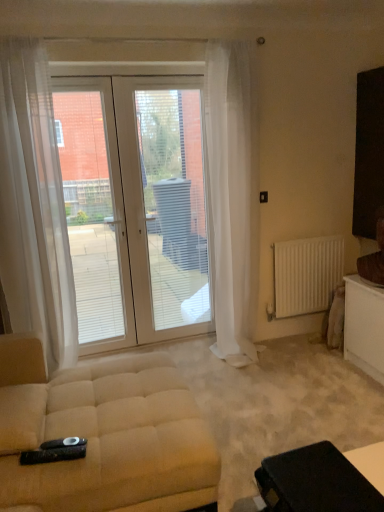
Question: Is white glass door at center to the left of white matte radiator at right from the viewer's perspective?

Choices:
 (A) yes
 (B) no

Answer: (A)

Question: Does white glass door at center have a smaller size compared to white matte radiator at right?

Choices:
 (A) no
 (B) yes

Answer: (A)

Question: Is white glass door at center far from white matte radiator at right?

Choices:
 (A) no
 (B) yes

Answer: (A)

Question: Can you confirm if white glass door at center is taller than white matte radiator at right?

Choices:
 (A) no
 (B) yes

Answer: (B)

Question: Can you see white glass door at center touching white matte radiator at right?

Choices:
 (A) yes
 (B) no

Answer: (B)

Question: Relative to beige fabric studio couch at lower left, is white glass door at center in front or behind?

Choices:
 (A) behind
 (B) front

Answer: (A)

Question: From the image's perspective, is white glass door at center above or below beige fabric studio couch at lower left?

Choices:
 (A) below
 (B) above

Answer: (B)

Question: From a real-world perspective, relative to beige fabric studio couch at lower left, is white glass door at center vertically above or below?

Choices:
 (A) above
 (B) below

Answer: (A)

Question: From their relative heights in the image, would you say white glass door at center is taller or shorter than beige fabric studio couch at lower left?

Choices:
 (A) tall
 (B) short

Answer: (A)

Question: Considering the positions of point (248, 190) and point (292, 256), is point (248, 190) closer or farther from the camera than point (292, 256)?

Choices:
 (A) farther
 (B) closer

Answer: (B)

Question: Is white sheer curtain at center, which appears as the 1th curtain when viewed from the right, in front of or behind white matte radiator at right in the image?

Choices:
 (A) behind
 (B) front

Answer: (B)

Question: Is white sheer curtain at center, the second curtain viewed from the left, to the left or to the right of white matte radiator at right in the image?

Choices:
 (A) left
 (B) right

Answer: (A)

Question: From a real-world perspective, is white sheer curtain at center, the second curtain viewed from the left, above or below white matte radiator at right?

Choices:
 (A) below
 (B) above

Answer: (B)

Question: In terms of width, does white sheer curtain at center, which appears as the 1th curtain when viewed from the right, look wider or thinner when compared to white glass door at center?

Choices:
 (A) thin
 (B) wide

Answer: (B)

Question: Considering the positions of white sheer curtain at center, which appears as the 1th curtain when viewed from the right, and white glass door at center in the image, is white sheer curtain at center, which appears as the 1th curtain when viewed from the right, bigger or smaller than white glass door at center?

Choices:
 (A) small
 (B) big

Answer: (B)